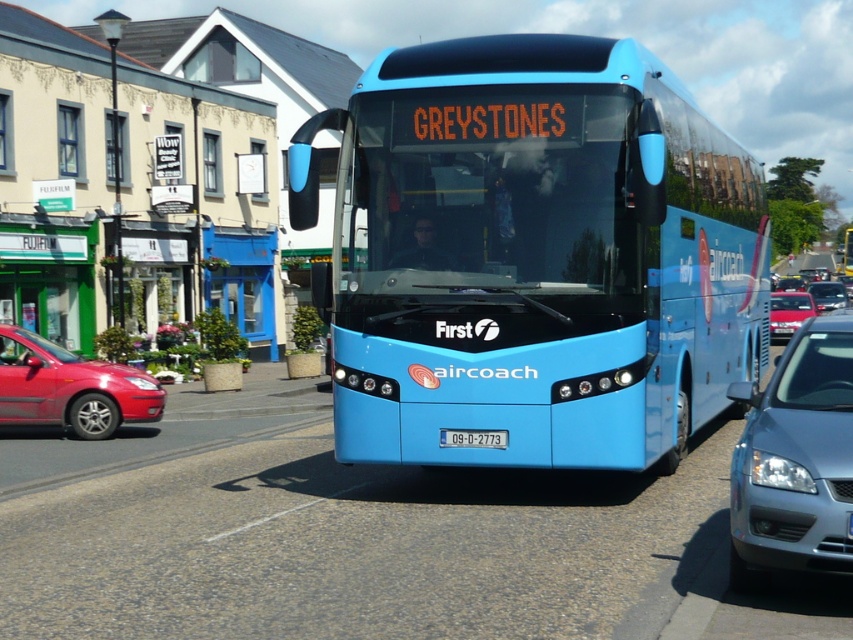
You are a pedestrian standing on the sidewalk and see both the blue glossy bus at center and the matte blue bus at center. Which one is positioned higher from the ground?

A: The blue glossy bus at center is positioned higher from the ground than the matte blue bus at center.

You are a delivery driver who needs to park your truck, which is 2 meters wide, between the satin silver sedan at center and the metallic red sedan at left. Can you fit your truck in that space?

The satin silver sedan at center is thinner than the metallic red sedan at left, so the space between them may be narrower than 2 meters. Therefore, the truck might not fit.